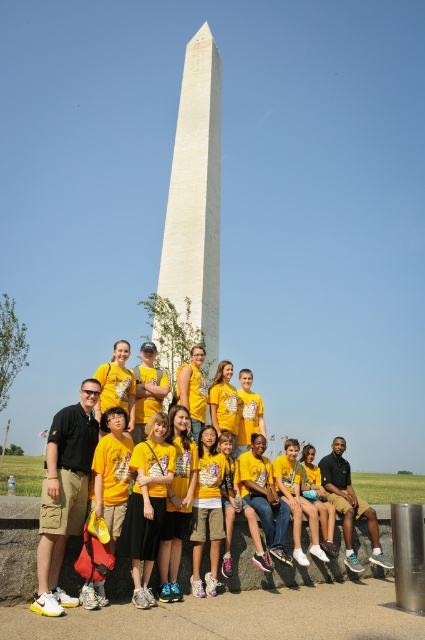
Can you confirm if yellow cotton shirt at center is taller than white marble obelisk at center?

No.

Find the location of a particular element. This screenshot has width=425, height=640. yellow cotton shirt at center is located at coordinates (98, 492).

Where is `yellow cotton shirt at center`? The height and width of the screenshot is (640, 425). yellow cotton shirt at center is located at coordinates (98, 492).